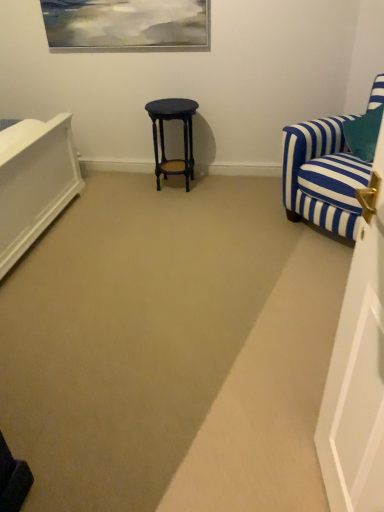
Question: From the image's perspective, is blue striped fabric chair at right over matte black stool at center?

Choices:
 (A) yes
 (B) no

Answer: (B)

Question: Does blue striped fabric chair at right have a lesser width compared to matte black stool at center?

Choices:
 (A) no
 (B) yes

Answer: (A)

Question: Considering the relative sizes of blue striped fabric chair at right and matte black stool at center in the image provided, is blue striped fabric chair at right wider than matte black stool at center?

Choices:
 (A) yes
 (B) no

Answer: (A)

Question: From the image's perspective, is blue striped fabric chair at right located beneath matte black stool at center?

Choices:
 (A) no
 (B) yes

Answer: (B)

Question: Does blue striped fabric chair at right have a smaller size compared to matte black stool at center?

Choices:
 (A) yes
 (B) no

Answer: (B)

Question: Is blue striped fabric chair at right facing towards matte black stool at center?

Choices:
 (A) no
 (B) yes

Answer: (A)

Question: Does matte black stool at center come behind blue striped fabric chair at right?

Choices:
 (A) yes
 (B) no

Answer: (A)

Question: Is matte black stool at center wider than blue striped fabric chair at right?

Choices:
 (A) yes
 (B) no

Answer: (B)

Question: Is matte black stool at center positioned with its back to blue striped fabric chair at right?

Choices:
 (A) no
 (B) yes

Answer: (A)

Question: Could you tell me if matte black stool at center is turned towards blue striped fabric chair at right?

Choices:
 (A) yes
 (B) no

Answer: (B)

Question: Considering the relative positions of matte black stool at center and blue striped fabric chair at right in the image provided, is matte black stool at center to the right of blue striped fabric chair at right from the viewer's perspective?

Choices:
 (A) yes
 (B) no

Answer: (B)

Question: From a real-world perspective, is matte black stool at center on top of blue striped fabric chair at right?

Choices:
 (A) no
 (B) yes

Answer: (A)

Question: Considering the positions of matte black stool at center and blue striped fabric chair at right in the image, is matte black stool at center wider or thinner than blue striped fabric chair at right?

Choices:
 (A) thin
 (B) wide

Answer: (A)